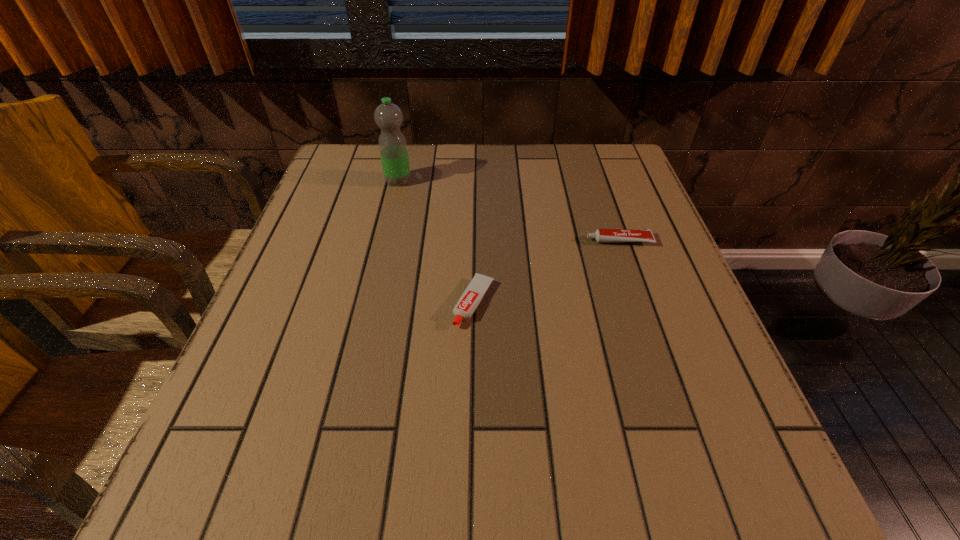
The width and height of the screenshot is (960, 540). Find the location of `object that is the second closest to the right toothpaste`. object that is the second closest to the right toothpaste is located at coordinates (388, 116).

You are a GUI agent. You are given a task and a screenshot of the screen. Output one action in this format:
    pyautogui.click(x=<x>, y=<y>)
    Task: Click on the blank space that satisfies the following two spatial constraints: 1. at the nozzle of the right toothpaste; 2. on the front side of the left toothpaste
    This screenshot has height=540, width=960.
    Given the screenshot: What is the action you would take?
    pyautogui.click(x=640, y=303)